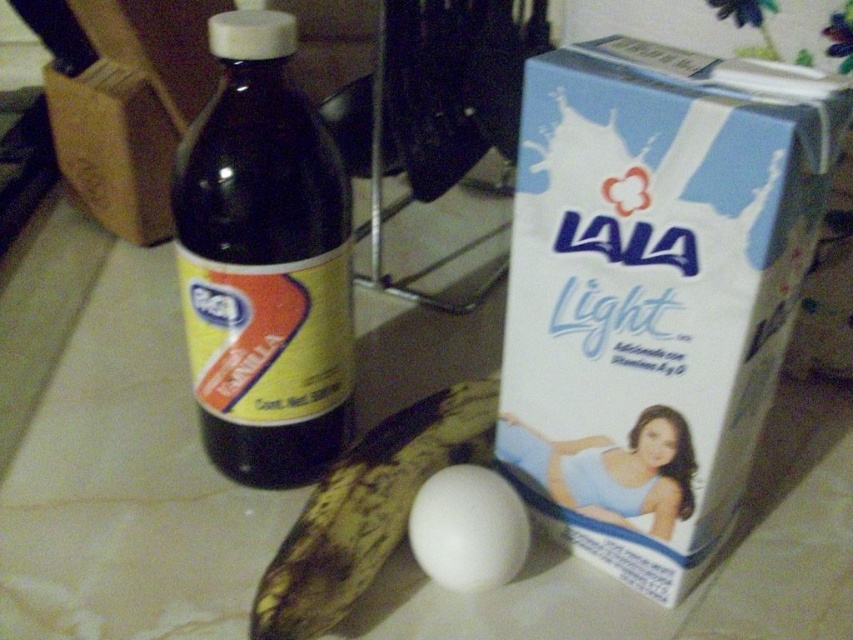
Is white cardboard box at right bigger than dark glass bottle at center?

Actually, white cardboard box at right might be smaller than dark glass bottle at center.

Which is above, white cardboard box at right or dark glass bottle at center?

dark glass bottle at center

Between point (695, 355) and point (300, 284), which one is positioned in front?

Positioned in front is point (695, 355).

Identify the location of white cardboard box at right. The width and height of the screenshot is (853, 640). (654, 291).

Who is more forward, (x=183, y=156) or (x=410, y=484)?

Point (x=183, y=156) is more forward.

In the scene shown: Who is more forward, (x=248, y=460) or (x=428, y=432)?

Point (x=428, y=432) is in front.

Identify the location of dark glass bottle at center. (264, 262).

Between yellow matte banana at center and white smooth egg at center, which one has less height?

white smooth egg at center is shorter.

Consider the image. Is yellow matte banana at center wider than white smooth egg at center?

Correct, the width of yellow matte banana at center exceeds that of white smooth egg at center.

Which is in front, point (392, 442) or point (514, 576)?

Point (514, 576) is in front.

Identify the location of yellow matte banana at center. Image resolution: width=853 pixels, height=640 pixels. (367, 509).